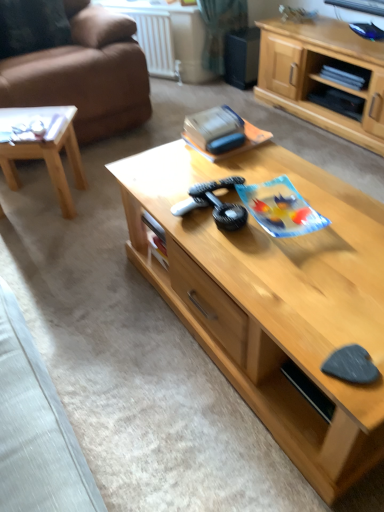
In order to face velvet dark brown pillow at upper left, should I rotate leftwards or rightwards?

Turn left approximately 21.364 degrees to face it.

What do you see at coordinates (32, 26) in the screenshot? The width and height of the screenshot is (384, 512). I see `velvet dark brown pillow at upper left` at bounding box center [32, 26].

In order to face light brown wood coffee table at left, positioned as the 1th coffee table in left-to-right order, should I rotate leftwards or rightwards?

Turn left by 20.504 degrees to look at light brown wood coffee table at left, positioned as the 1th coffee table in left-to-right order.

Measure the distance between light brown wood coffee table at left, marked as the 2th coffee table in a right-to-left arrangement, and camera.

light brown wood coffee table at left, marked as the 2th coffee table in a right-to-left arrangement, is 5.77 feet from camera.

Describe the element at coordinates (319, 76) in the screenshot. I see `light wood cabinet at center` at that location.

At what (x,y) coordinates should I click in order to perform the action: click on white plastic radiator at upper center. Please return your answer as a coordinate pair (x, y). Looking at the image, I should click on (152, 37).

Looking at their sizes, would you say light brown wood coffee table at left, marked as the 2th coffee table in a right-to-left arrangement, is wider or thinner than white plastic radiator at upper center?

light brown wood coffee table at left, marked as the 2th coffee table in a right-to-left arrangement, is wider than white plastic radiator at upper center.

Is light brown wood coffee table at left, positioned as the 1th coffee table in left-to-right order, taller or shorter than white plastic radiator at upper center?

light brown wood coffee table at left, positioned as the 1th coffee table in left-to-right order, is shorter than white plastic radiator at upper center.

From the picture: From the image's perspective, would you say light brown wood coffee table at left, marked as the 2th coffee table in a right-to-left arrangement, is positioned over white plastic radiator at upper center?

No, from the image's perspective, light brown wood coffee table at left, marked as the 2th coffee table in a right-to-left arrangement, is not on top of white plastic radiator at upper center.

Is light brown wood coffee table at left, positioned as the 1th coffee table in left-to-right order, oriented away from white plastic radiator at upper center?

No, light brown wood coffee table at left, positioned as the 1th coffee table in left-to-right order, is not facing away from white plastic radiator at upper center.

Is light wood coffee table at center, acting as the 1th coffee table starting from the right, to the left or to the right of light wood cabinet at center in the image?

Based on their positions, light wood coffee table at center, acting as the 1th coffee table starting from the right, is located to the left of light wood cabinet at center.

Is light wood coffee table at center, acting as the 1th coffee table starting from the right, facing towards light wood cabinet at center?

Yes, light wood coffee table at center, acting as the 1th coffee table starting from the right, is turned towards light wood cabinet at center.

Identify the location of the 1st coffee table to the left of the light wood cabinet at center, starting your count from the anchor. The width and height of the screenshot is (384, 512). (274, 298).

Considering their positions, is light wood coffee table at center, which is counted as the second coffee table, starting from the left, located in front of or behind light wood cabinet at center?

light wood coffee table at center, which is counted as the second coffee table, starting from the left, is positioned closer to the viewer than light wood cabinet at center.

Is light wood coffee table at center, acting as the 1th coffee table starting from the right, inside the boundaries of brown leather couch at left, or outside?

light wood coffee table at center, acting as the 1th coffee table starting from the right, cannot be found inside brown leather couch at left.

Considering the positions of point (364, 415) and point (15, 60), is point (364, 415) closer or farther from the camera than point (15, 60)?

Point (364, 415) is closer to the camera than point (15, 60).

Is light wood coffee table at center, which is counted as the second coffee table, starting from the left, taller or shorter than brown leather couch at left?

In the image, light wood coffee table at center, which is counted as the second coffee table, starting from the left, appears to be shorter than brown leather couch at left.

Is light wood coffee table at center, which is counted as the second coffee table, starting from the left, oriented away from brown leather couch at left?

light wood coffee table at center, which is counted as the second coffee table, starting from the left, does not have its back to brown leather couch at left.

Is brown leather couch at left touching white plastic radiator at upper center?

They are not placed beside each other.

Can you tell me how much brown leather couch at left and white plastic radiator at upper center differ in facing direction?

59.8 degrees separate the facing orientations of brown leather couch at left and white plastic radiator at upper center.

In terms of size, does brown leather couch at left appear bigger or smaller than white plastic radiator at upper center?

Considering their sizes, brown leather couch at left takes up more space than white plastic radiator at upper center.

From a real-world perspective, is brown leather couch at left under white plastic radiator at upper center?

No, from a real-world perspective, brown leather couch at left is not under white plastic radiator at upper center.

Is the surface of light wood coffee table at center, which is counted as the second coffee table, starting from the left, in direct contact with light brown wood coffee table at left, positioned as the 1th coffee table in left-to-right order?

light wood coffee table at center, which is counted as the second coffee table, starting from the left, and light brown wood coffee table at left, positioned as the 1th coffee table in left-to-right order, are not in contact.

How different are the orientations of light wood coffee table at center, which is counted as the second coffee table, starting from the left, and light brown wood coffee table at left, positioned as the 1th coffee table in left-to-right order, in degrees?

They differ by 34.3 degrees in their facing directions.

Between light wood coffee table at center, acting as the 1th coffee table starting from the right, and light brown wood coffee table at left, positioned as the 1th coffee table in left-to-right order, which one has smaller width?

Thinner between the two is light brown wood coffee table at left, positioned as the 1th coffee table in left-to-right order.

Considering the positions of objects light wood coffee table at center, acting as the 1th coffee table starting from the right, and light brown wood coffee table at left, marked as the 2th coffee table in a right-to-left arrangement, in the image provided, who is behind, light wood coffee table at center, acting as the 1th coffee table starting from the right, or light brown wood coffee table at left, marked as the 2th coffee table in a right-to-left arrangement,?

Positioned behind is light brown wood coffee table at left, marked as the 2th coffee table in a right-to-left arrangement.

Who is bigger, light wood coffee table at center, acting as the 1th coffee table starting from the right, or white plastic radiator at upper center?

light wood coffee table at center, acting as the 1th coffee table starting from the right, is bigger.

Is white plastic radiator at upper center a part of light wood coffee table at center, acting as the 1th coffee table starting from the right?

No, white plastic radiator at upper center is not surrounded by light wood coffee table at center, acting as the 1th coffee table starting from the right.

Does velvet dark brown pillow at upper left have a greater height compared to white plastic radiator at upper center?

In fact, velvet dark brown pillow at upper left may be shorter than white plastic radiator at upper center.

Does velvet dark brown pillow at upper left touch white plastic radiator at upper center?

No, velvet dark brown pillow at upper left is not in contact with white plastic radiator at upper center.

Between point (3, 56) and point (136, 20), which one is positioned behind?

The point (136, 20) is behind.

Locate an element on the screen. pillow lying on the left of white plastic radiator at upper center is located at coordinates (32, 26).

From the image's perspective, starting from the white plastic radiator at upper center, which coffee table is the 1st one below? Please provide its 2D coordinates.

[(42, 147)]

Identify the location of the 1st coffee table to the left of the light wood cabinet at center, counting from the anchor's position. (274, 298).

Looking at this image, from the image, which object appears to be farther from light brown wood coffee table at left, marked as the 2th coffee table in a right-to-left arrangement, velvet dark brown pillow at upper left or light wood cabinet at center?

Based on the image, light wood cabinet at center appears to be further to light brown wood coffee table at left, marked as the 2th coffee table in a right-to-left arrangement.

Based on their spatial positions, is velvet dark brown pillow at upper left or light wood cabinet at center closer to brown leather couch at left?

velvet dark brown pillow at upper left is positioned closer to the anchor brown leather couch at left.

Based on their spatial positions, is light brown wood coffee table at left, positioned as the 1th coffee table in left-to-right order, or light wood coffee table at center, which is counted as the second coffee table, starting from the left, further from white plastic radiator at upper center?

The object further to white plastic radiator at upper center is light wood coffee table at center, which is counted as the second coffee table, starting from the left.

Looking at the image, which one is located further to velvet dark brown pillow at upper left, light wood coffee table at center, acting as the 1th coffee table starting from the right, or white plastic radiator at upper center?

The object further to velvet dark brown pillow at upper left is light wood coffee table at center, acting as the 1th coffee table starting from the right.

Which object lies nearer to the anchor point light wood cabinet at center, velvet dark brown pillow at upper left or light wood coffee table at center, which is counted as the second coffee table, starting from the left?

Among the two, light wood coffee table at center, which is counted as the second coffee table, starting from the left, is located nearer to light wood cabinet at center.

When comparing their distances from velvet dark brown pillow at upper left, does light wood coffee table at center, which is counted as the second coffee table, starting from the left, or light wood cabinet at center seem closer?

light wood cabinet at center lies closer to velvet dark brown pillow at upper left than the other object.

Based on their spatial positions, is light wood coffee table at center, acting as the 1th coffee table starting from the right, or light brown wood coffee table at left, positioned as the 1th coffee table in left-to-right order, further from brown leather couch at left?

light wood coffee table at center, acting as the 1th coffee table starting from the right, is further to brown leather couch at left.

From the image, which object appears to be farther from light brown wood coffee table at left, positioned as the 1th coffee table in left-to-right order, light wood coffee table at center, which is counted as the second coffee table, starting from the left, or velvet dark brown pillow at upper left?

light wood coffee table at center, which is counted as the second coffee table, starting from the left, is further to light brown wood coffee table at left, positioned as the 1th coffee table in left-to-right order.

Where is `studio couch between light wood coffee table at center, acting as the 1th coffee table starting from the right, and white plastic radiator at upper center, along the z-axis`? Image resolution: width=384 pixels, height=512 pixels. studio couch between light wood coffee table at center, acting as the 1th coffee table starting from the right, and white plastic radiator at upper center, along the z-axis is located at coordinates (85, 74).

At what (x,y) coordinates should I click in order to perform the action: click on coffee table between velvet dark brown pillow at upper left and light wood coffee table at center, which is counted as the second coffee table, starting from the left, in the vertical direction. Please return your answer as a coordinate pair (x, y). This screenshot has height=512, width=384. Looking at the image, I should click on (42, 147).

This screenshot has height=512, width=384. In order to click on studio couch positioned between light brown wood coffee table at left, positioned as the 1th coffee table in left-to-right order, and white plastic radiator at upper center from near to far in this screenshot , I will do `click(85, 74)`.

The image size is (384, 512). What are the coordinates of `studio couch between velvet dark brown pillow at upper left and light wood cabinet at center` in the screenshot? It's located at [x=85, y=74].